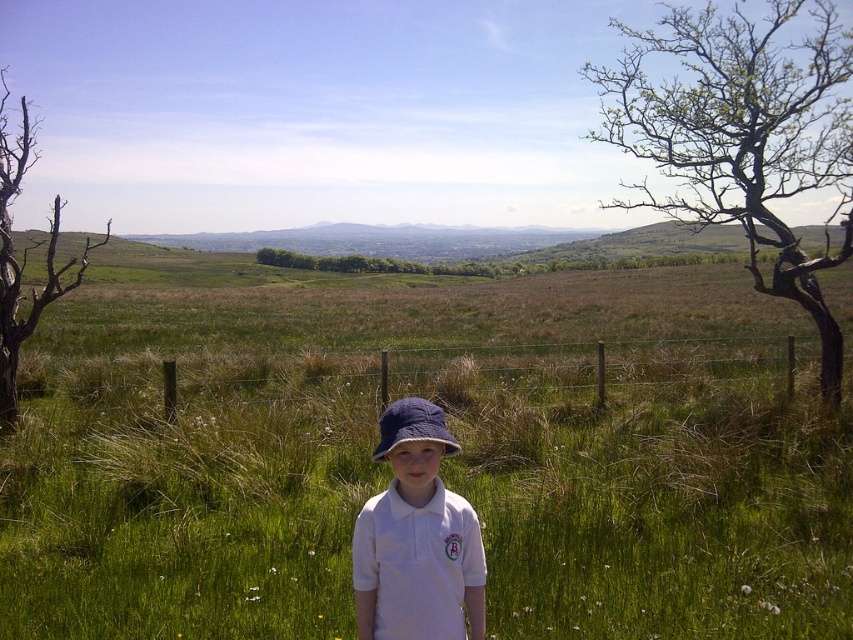
You are a photographer planning to capture a landscape photo that includes both the bare wood tree at upper right and the blue fabric hat at center. Since you want the tree to appear larger in the photo than the hat, which object should you move closer to the camera?

To make the bare wood tree at upper right appear larger than the blue fabric hat at center in the photo, you should move closer to the bare wood tree at upper right. Since it is much taller, positioning the camera nearer to it will emphasize its size relative to the hat.

You are a hiker who wants to place a small backpack between the brown dead wood at left and the blue fabric hat at center. Based on their positions, will the backpack fit horizontally between them?

The brown dead wood at left is to the left of blue fabric hat at center, so placing a backpack between them horizontally should be possible as there is space between the two objects.